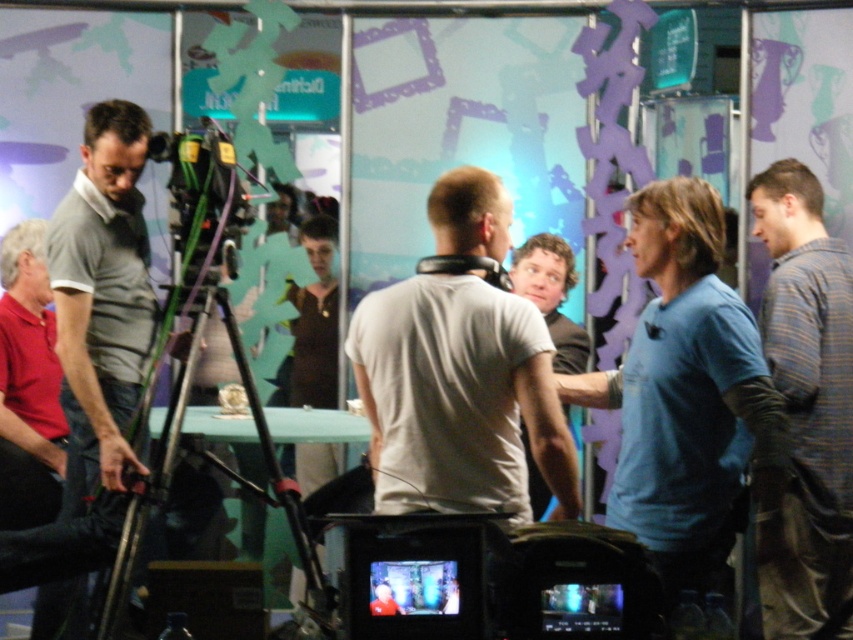
Question: Does white matte t-shirt at center appear on the left side of red cotton polo shirt at left?

Choices:
 (A) yes
 (B) no

Answer: (B)

Question: Among these points, which one is nearest to the camera?

Choices:
 (A) (163, 483)
 (B) (618, 406)
 (C) (850, 436)
 (D) (1, 285)

Answer: (A)

Question: Which object appears closest to the camera in this image?

Choices:
 (A) light gray t-shirt at center
 (B) red cotton polo shirt at left
 (C) plaid shirt at right
 (D) blue cotton shirt at center

Answer: (D)

Question: Which object is closer to the camera taking this photo?

Choices:
 (A) white matte t-shirt at center
 (B) blue cotton shirt at center
 (C) gray polo shirt at left
 (D) light gray t-shirt at center

Answer: (B)

Question: Considering the relative positions of plaid shirt at right and light gray t-shirt at center in the image provided, where is plaid shirt at right located with respect to light gray t-shirt at center?

Choices:
 (A) above
 (B) below

Answer: (B)

Question: Is blue cotton shirt at center positioned at the back of plaid shirt at right?

Choices:
 (A) yes
 (B) no

Answer: (B)